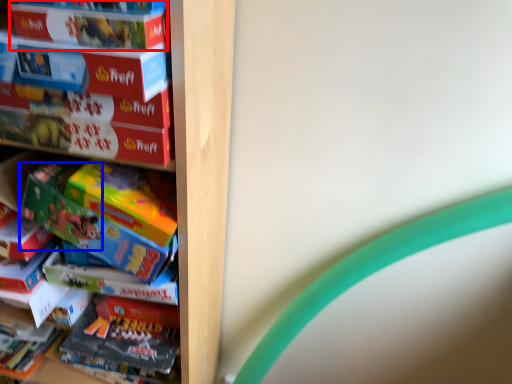
Question: Among these objects, which one is farthest to the camera, paperback book (highlighted by a red box) or toy (highlighted by a blue box)?

Choices:
 (A) paperback book
 (B) toy

Answer: (B)